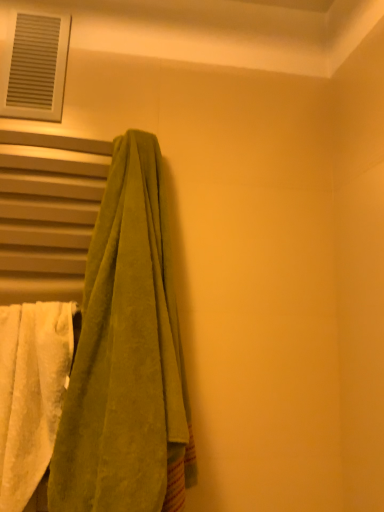
Question: Does white fluffy towel at left, which is the second towel from right to left, appear on the right side of green velvety towel at left, which is counted as the 2th towel, starting from the left?

Choices:
 (A) yes
 (B) no

Answer: (B)

Question: Is white fluffy towel at left, placed as the 1th towel when sorted from left to right, facing towards green velvety towel at left, which is counted as the 2th towel, starting from the left?

Choices:
 (A) no
 (B) yes

Answer: (A)

Question: Is green velvety towel at left, the 1th towel in the right-to-left sequence, at the back of white fluffy towel at left, placed as the 1th towel when sorted from left to right?

Choices:
 (A) yes
 (B) no

Answer: (B)

Question: Does white fluffy towel at left, which is the second towel from right to left, have a lesser height compared to green velvety towel at left, which is counted as the 2th towel, starting from the left?

Choices:
 (A) no
 (B) yes

Answer: (B)

Question: Is white fluffy towel at left, which is the second towel from right to left, positioned beyond the bounds of green velvety towel at left, which is counted as the 2th towel, starting from the left?

Choices:
 (A) no
 (B) yes

Answer: (B)

Question: Considering their positions, is green velvety towel at left, the 1th towel in the right-to-left sequence, located in front of or behind white fluffy towel at left, which is the second towel from right to left?

Choices:
 (A) front
 (B) behind

Answer: (A)

Question: Looking at the image, does green velvety towel at left, the 1th towel in the right-to-left sequence, seem bigger or smaller compared to white fluffy towel at left, placed as the 1th towel when sorted from left to right?

Choices:
 (A) big
 (B) small

Answer: (A)

Question: Considering the positions of green velvety towel at left, the 1th towel in the right-to-left sequence, and white fluffy towel at left, placed as the 1th towel when sorted from left to right, in the image, is green velvety towel at left, the 1th towel in the right-to-left sequence, taller or shorter than white fluffy towel at left, placed as the 1th towel when sorted from left to right,?

Choices:
 (A) tall
 (B) short

Answer: (A)

Question: From a real-world perspective, relative to white fluffy towel at left, which is the second towel from right to left, is green velvety towel at left, the 1th towel in the right-to-left sequence, vertically above or below?

Choices:
 (A) below
 (B) above

Answer: (B)

Question: Based on their positions, is white fluffy towel at left, which is the second towel from right to left, located to the left or right of white plastic vent at upper left?

Choices:
 (A) left
 (B) right

Answer: (B)

Question: Is point (43, 323) positioned closer to the camera than point (16, 19)?

Choices:
 (A) farther
 (B) closer

Answer: (B)

Question: Considering the positions of white fluffy towel at left, which is the second towel from right to left, and white plastic vent at upper left in the image, is white fluffy towel at left, which is the second towel from right to left, bigger or smaller than white plastic vent at upper left?

Choices:
 (A) small
 (B) big

Answer: (B)

Question: From the image's perspective, is white fluffy towel at left, which is the second towel from right to left, above or below white plastic vent at upper left?

Choices:
 (A) below
 (B) above

Answer: (A)

Question: From a real-world perspective, relative to white fluffy towel at left, placed as the 1th towel when sorted from left to right, is white plastic vent at upper left vertically above or below?

Choices:
 (A) below
 (B) above

Answer: (B)

Question: From the image's perspective, is white plastic vent at upper left located above or below white fluffy towel at left, which is the second towel from right to left?

Choices:
 (A) below
 (B) above

Answer: (B)